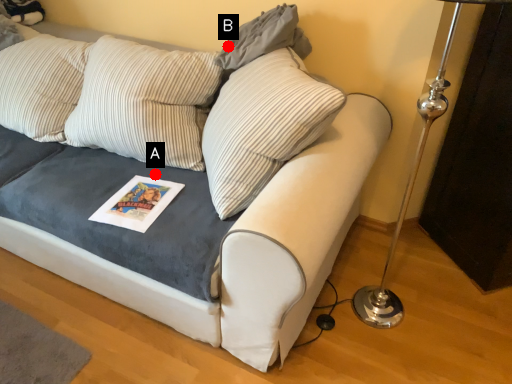
Question: Two points are circled on the image, labeled by A and B beside each circle. Which point is closer to the camera?

Choices:
 (A) A is closer
 (B) B is closer

Answer: (A)